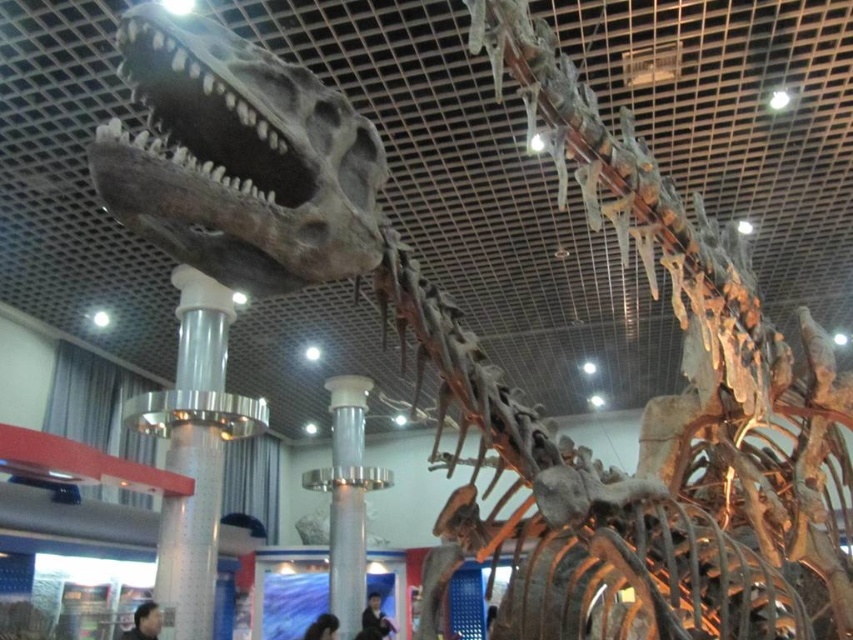
Question: Can you confirm if silver metallic column at center is positioned below silver metallic pillar at center?

Choices:
 (A) no
 (B) yes

Answer: (A)

Question: Which object is farther from the camera taking this photo?

Choices:
 (A) silver metallic column at center
 (B) silver metallic pillar at center

Answer: (B)

Question: Among these points, which one is farthest from the camera?

Choices:
 (A) (198, 464)
 (B) (337, 380)

Answer: (B)

Question: Can you confirm if silver metallic column at center is positioned to the right of silver metallic pillar at center?

Choices:
 (A) no
 (B) yes

Answer: (A)

Question: Does silver metallic column at center appear on the left side of silver metallic pillar at center?

Choices:
 (A) no
 (B) yes

Answer: (B)